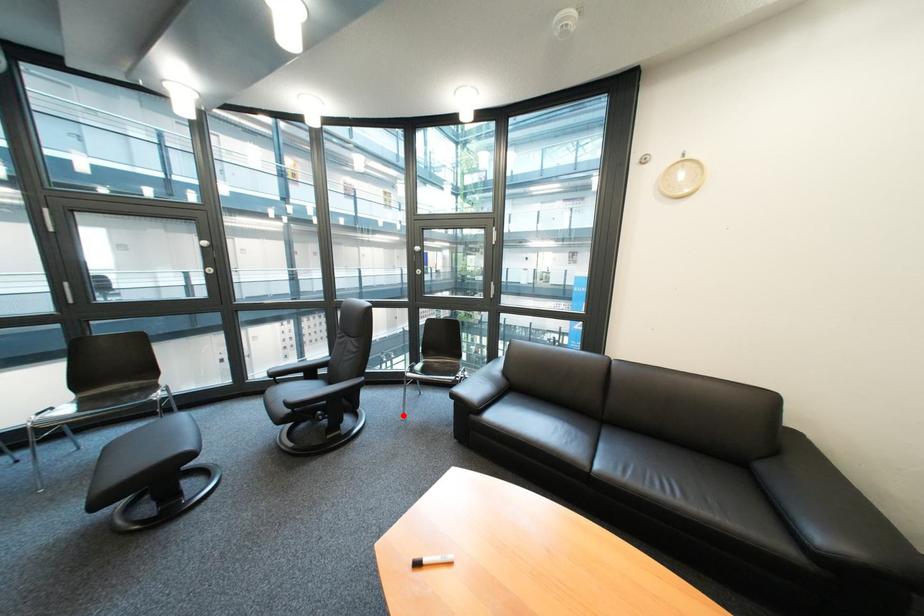
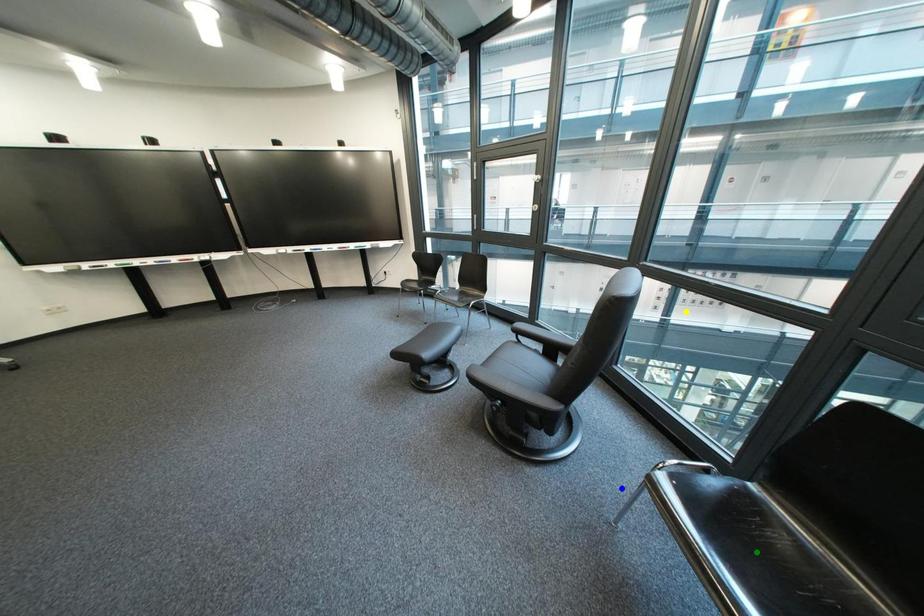
Question: I am providing you with two images of the same scene from different viewpoints. A red point is marked on the first image. You are given multiple points on the second image. In image 2, which mark is for the same physical point as the one in image 1?

Choices:
 (A) blue point
 (B) yellow point
 (C) green point

Answer: (A)